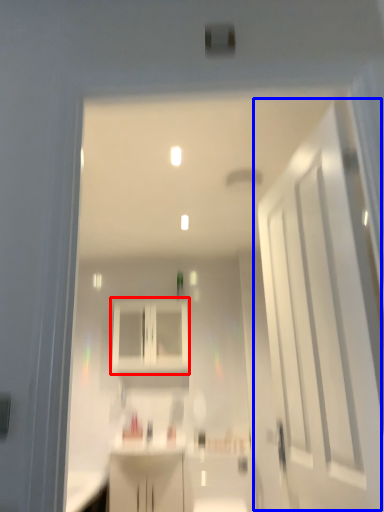
Question: Which object appears closest to the camera in this image, cabinetry (highlighted by a red box) or door (highlighted by a blue box)?

Choices:
 (A) cabinetry
 (B) door

Answer: (B)